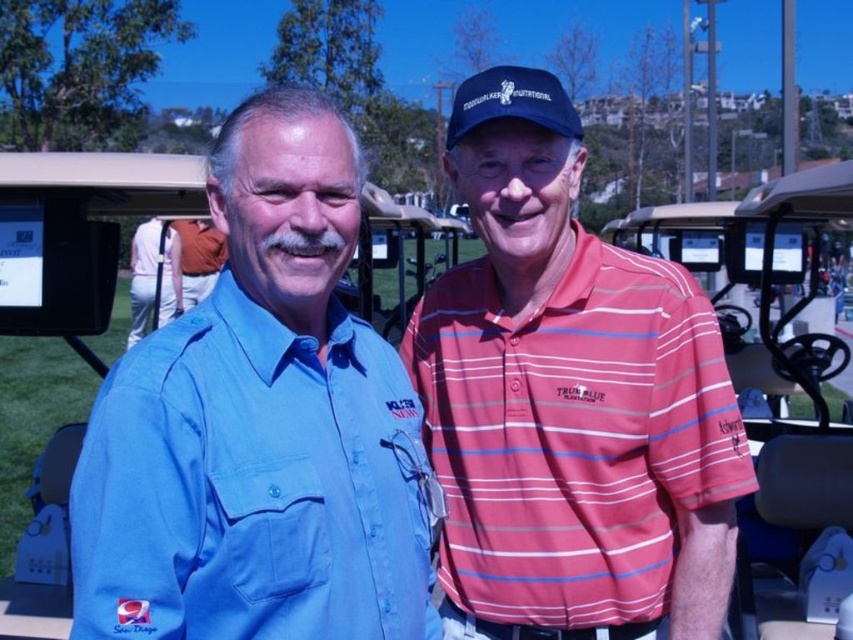
Is matte blue shirt at left positioned in front of white cotton polo shirt at center?

Yes, it is in front of white cotton polo shirt at center.

How distant is matte blue shirt at left from white cotton polo shirt at center?

10.93 meters

Which is in front, point (418, 488) or point (160, 308)?

Point (418, 488) is more forward.

Identify the location of matte blue shirt at left. Image resolution: width=853 pixels, height=640 pixels. (260, 426).

Who is higher up, striped cotton polo shirt at center or matte black baseball cap at center?

matte black baseball cap at center is higher up.

Is striped cotton polo shirt at center above matte black baseball cap at center?

Incorrect, striped cotton polo shirt at center is not positioned above matte black baseball cap at center.

Is point (593, 451) more distant than point (556, 120)?

Yes, point (593, 451) is behind point (556, 120).

Find the location of a particular element. The height and width of the screenshot is (640, 853). striped cotton polo shirt at center is located at coordinates (567, 401).

Does matte blue shirt at left appear on the right side of striped cotton polo shirt at center?

No, matte blue shirt at left is not to the right of striped cotton polo shirt at center.

Is point (164, 596) positioned in front of point (572, 163)?

Yes, point (164, 596) is closer to viewer.

Is point (271, 285) positioned after point (521, 282)?

No, (271, 285) is closer to viewer.

Image resolution: width=853 pixels, height=640 pixels. I want to click on matte blue shirt at left, so click(260, 426).